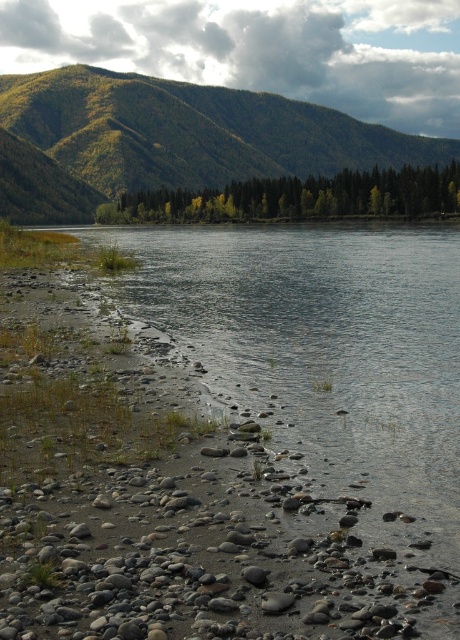
Does green forested mountain at upper center have a greater height compared to green matte trees at center?

Correct, green forested mountain at upper center is much taller as green matte trees at center.

Who is more forward, (409, 157) or (408, 211)?

Point (408, 211) is more forward.

Identify the location of green forested mountain at upper center. (171, 140).